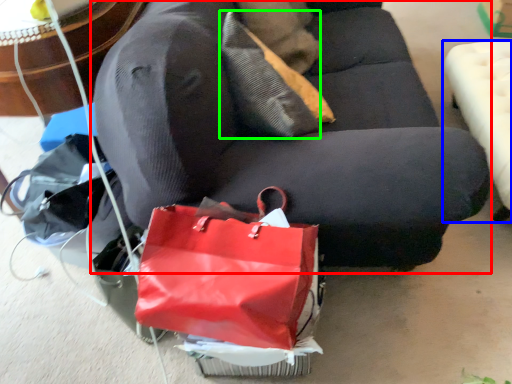
Question: Which object is positioned closest to studio couch (highlighted by a red box)? Select from furniture (highlighted by a blue box) and pillow (highlighted by a green box).

Choices:
 (A) furniture
 (B) pillow

Answer: (B)